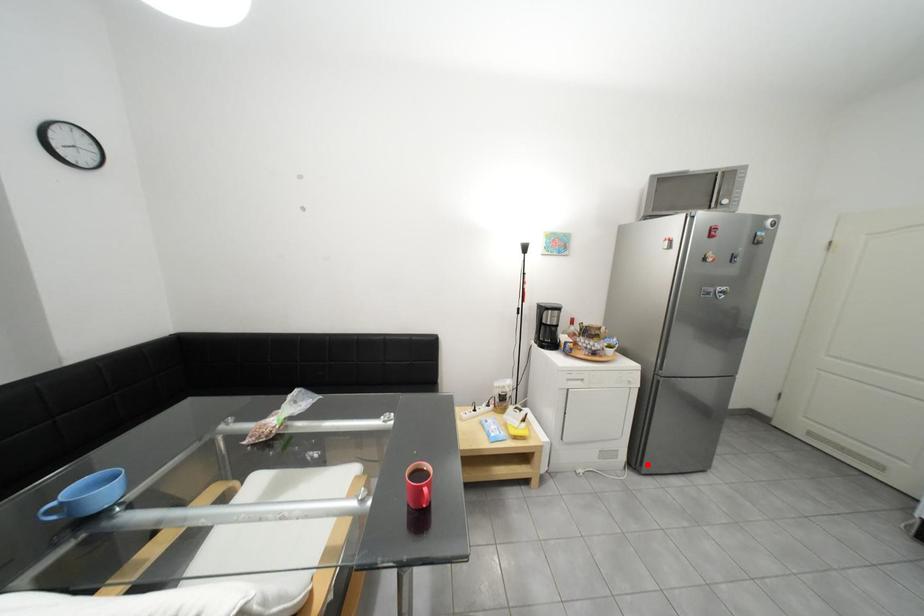
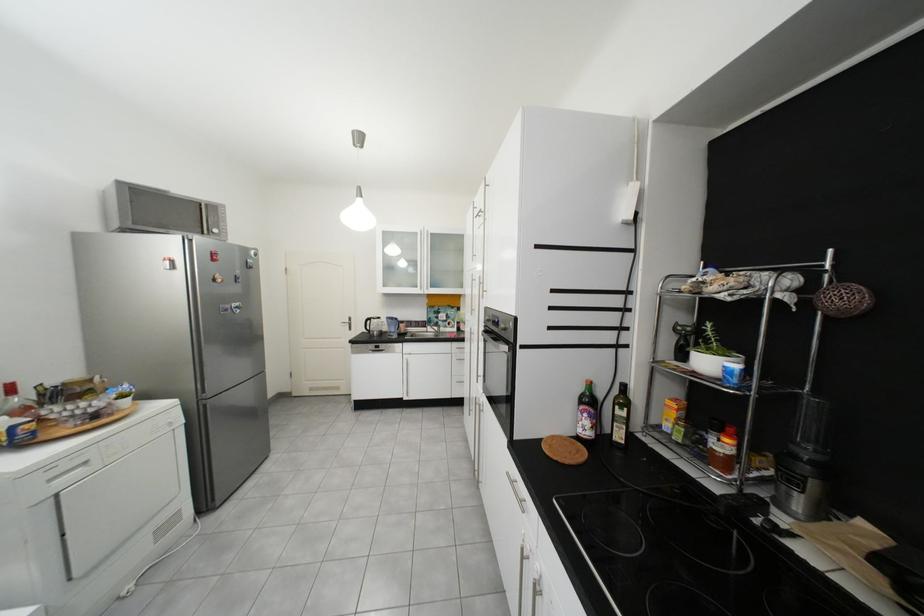
Question: I am providing you with two images of the same scene from different viewpoints. Given a red point in image1, look at the same physical point in image2. Is it:

Choices:
 (A) Closer to the viewpoint
 (B) Farther from the viewpoint

Answer: (A)